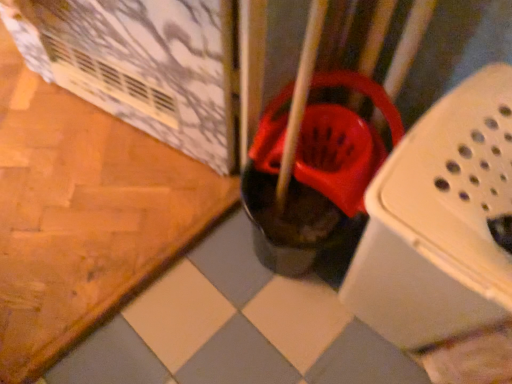
Question: From the image's perspective, is white plastic laundry basket at center located above or below rubberized red bucket at center?

Choices:
 (A) below
 (B) above

Answer: (A)

Question: Considering their positions, is white plastic laundry basket at center located in front of or behind rubberized red bucket at center?

Choices:
 (A) behind
 (B) front

Answer: (B)

Question: From a real-world perspective, is white plastic laundry basket at center positioned above or below rubberized red bucket at center?

Choices:
 (A) below
 (B) above

Answer: (B)

Question: From the image's perspective, is rubberized red bucket at center positioned above or below white plastic laundry basket at center?

Choices:
 (A) above
 (B) below

Answer: (A)

Question: Considering the positions of rubberized red bucket at center and white plastic laundry basket at center in the image, is rubberized red bucket at center wider or thinner than white plastic laundry basket at center?

Choices:
 (A) wide
 (B) thin

Answer: (A)

Question: From a real-world perspective, is rubberized red bucket at center positioned above or below white plastic laundry basket at center?

Choices:
 (A) above
 (B) below

Answer: (B)

Question: Considering the positions of point (315, 79) and point (502, 94), is point (315, 79) closer or farther from the camera than point (502, 94)?

Choices:
 (A) farther
 (B) closer

Answer: (A)